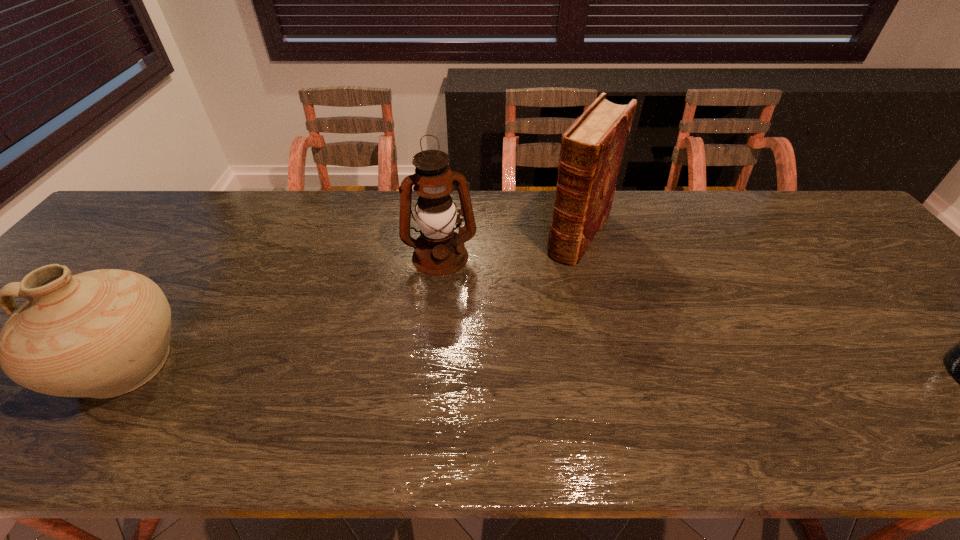
At what (x,y) coordinates should I click in order to perform the action: click on pottery. Please return your answer as a coordinate pair (x, y). Looking at the image, I should click on (103, 333).

Identify the location of the second shortest object. This screenshot has height=540, width=960. pos(103,333).

Locate an element on the screen. the third object from right to left is located at coordinates (439, 251).

The width and height of the screenshot is (960, 540). Identify the location of hardback book. (592, 148).

Where is `vacant point located 0.320m on the right of the pottery`? vacant point located 0.320m on the right of the pottery is located at coordinates (332, 363).

The image size is (960, 540). What are the coordinates of `free location located 0.320m on the side of the second object from left to right, there is a wick adjustment knob` in the screenshot? It's located at (454, 381).

Image resolution: width=960 pixels, height=540 pixels. What are the coordinates of `blank area located on the side of the second object from left to right, there is a wick adjustment knob` in the screenshot? It's located at (447, 320).

The image size is (960, 540). In order to click on vacant space positioned on the side of the second object from left to right, there is a wick adjustment knob in this screenshot , I will do point(448,327).

The height and width of the screenshot is (540, 960). I want to click on vacant area situated on the spine side of the hardback book, so click(495, 369).

You are a GUI agent. You are given a task and a screenshot of the screen. Output one action in this format:
    pyautogui.click(x=<x>, y=<y>)
    Task: Click on the blank space located 0.140m on the spine side of the hardback book
    This screenshot has width=960, height=540.
    Given the screenshot: What is the action you would take?
    pyautogui.click(x=545, y=294)